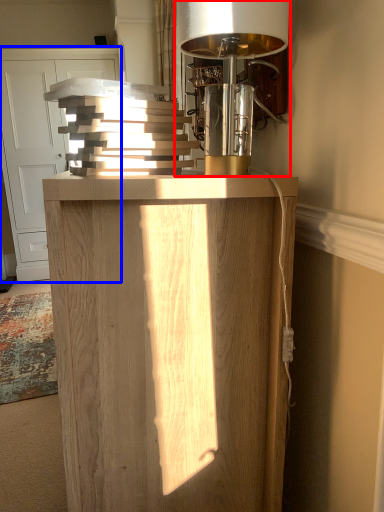
Question: Which object appears farthest to the camera in this image, table lamp (highlighted by a red box) or cabinetry (highlighted by a blue box)?

Choices:
 (A) table lamp
 (B) cabinetry

Answer: (B)